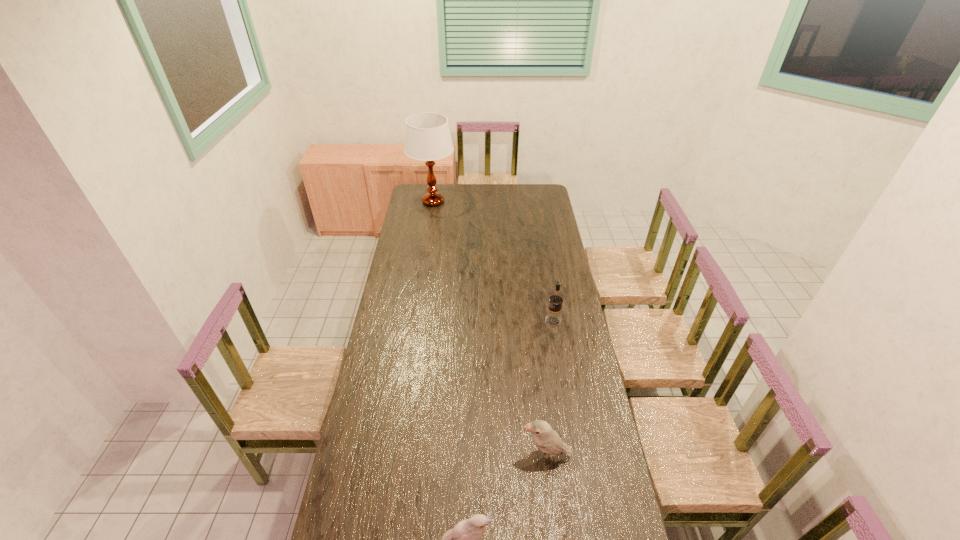
This screenshot has width=960, height=540. What are the coordinates of `the leftmost object` in the screenshot? It's located at (428, 138).

Find the location of a particular element. the tallest object is located at coordinates (428, 138).

Where is `the second farthest object`? the second farthest object is located at coordinates (553, 317).

Where is `the taller bird`? The height and width of the screenshot is (540, 960). the taller bird is located at coordinates (547, 440).

Locate an element on the screen. Image resolution: width=960 pixels, height=540 pixels. the farther bird is located at coordinates (547, 440).

Find the location of `free spot located 0.320m on the front of the leftmost object`. free spot located 0.320m on the front of the leftmost object is located at coordinates (426, 245).

You are a GUI agent. You are given a task and a screenshot of the screen. Output one action in this format:
    pyautogui.click(x=<x>, y=<y>)
    Task: Click on the vacant position located on the label of the vodka
    Image resolution: width=960 pixels, height=540 pixels.
    Given the screenshot: What is the action you would take?
    pyautogui.click(x=519, y=321)

I want to click on free space located on the label of the vodka, so click(474, 321).

Find the location of a particular element. free space located 0.050m on the label of the vodka is located at coordinates (535, 321).

Where is `vacant space located 0.230m at the face of the second nearest object`? vacant space located 0.230m at the face of the second nearest object is located at coordinates pos(455,456).